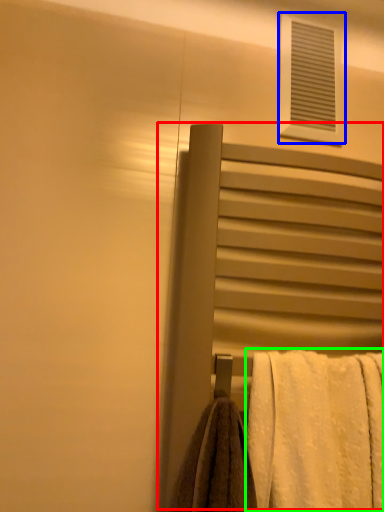
Question: Which is nearer to the screen door (highlighted by a red box)? window (highlighted by a blue box) or towel (highlighted by a green box).

Choices:
 (A) window
 (B) towel

Answer: (B)